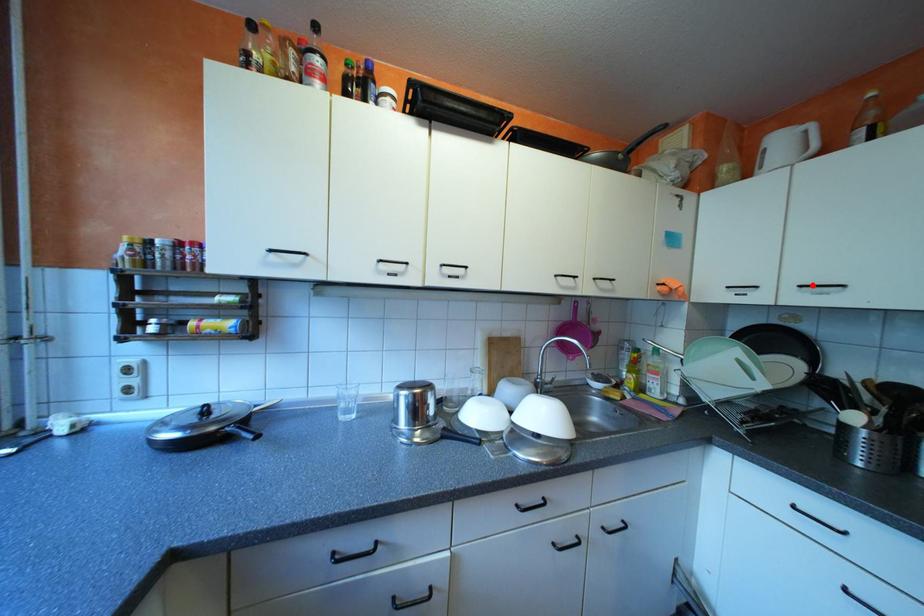
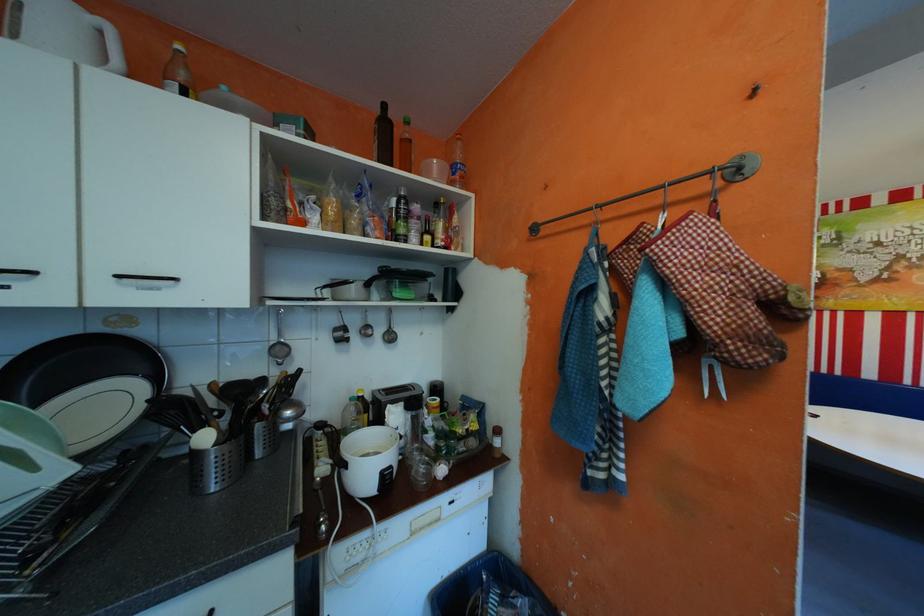
In the second image, find the point that corresponds to the highlighted location in the first image.

(130, 275)